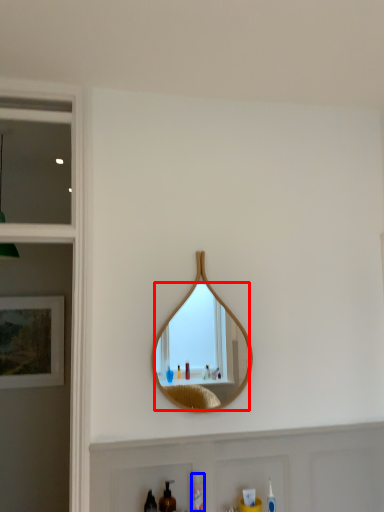
Question: Which of the following is the closest to the observer, mirror (highlighted by a red box) or mouthwash (highlighted by a blue box)?

Choices:
 (A) mirror
 (B) mouthwash

Answer: (B)